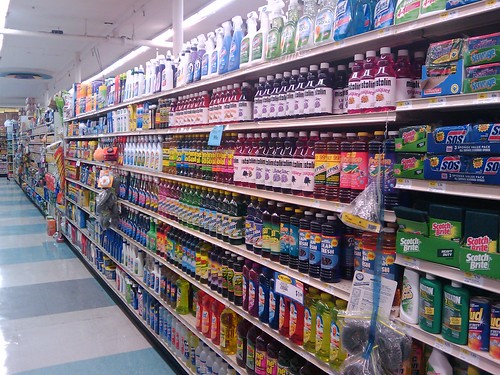
At what (x,y) coordinates should I click in order to perform the action: click on yellow cleaning supplies. Please return your answer as a coordinate pair (x, y). The image size is (500, 375). Looking at the image, I should click on (329, 351), (314, 336), (304, 327), (167, 160), (165, 145), (179, 291), (223, 327).